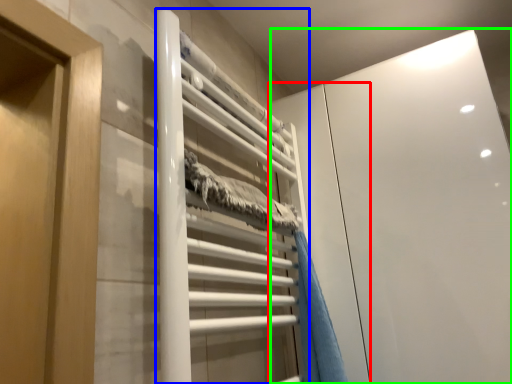
Question: Considering the real-world distances, which object is closest to screen door (highlighted by a red box)? stair (highlighted by a blue box) or glass door (highlighted by a green box).

Choices:
 (A) stair
 (B) glass door

Answer: (B)